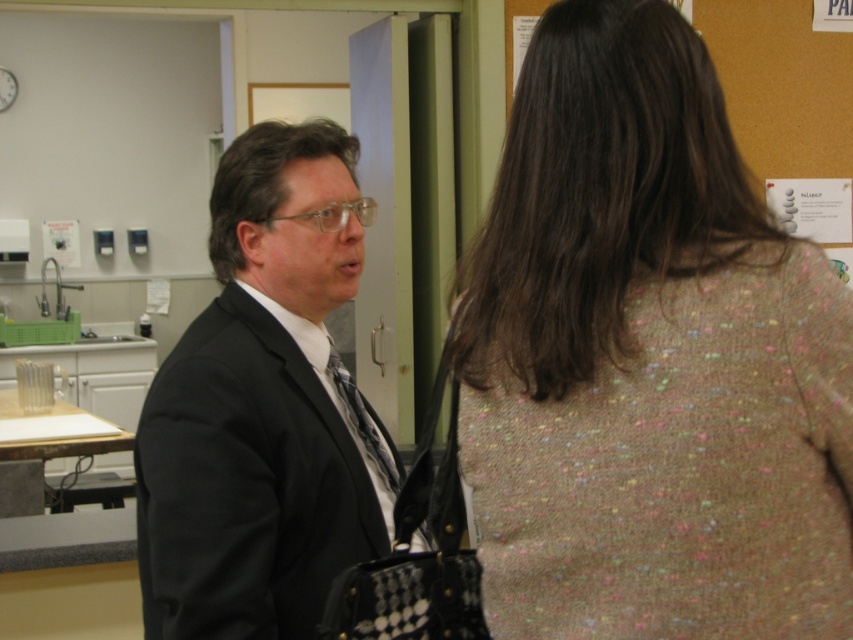
The width and height of the screenshot is (853, 640). What do you see at coordinates (648, 360) in the screenshot?
I see `speckled wool sweater at upper right` at bounding box center [648, 360].

Is point (534, 429) positioned behind point (389, 468)?

No, it is not.

Where is `speckled wool sweater at upper right`? speckled wool sweater at upper right is located at coordinates (648, 360).

Does black matte suit at center have a smaller size compared to patterned silk tie at center?

No.

Looking at this image, which is more to the left, black matte suit at center or patterned silk tie at center?

Positioned to the left is black matte suit at center.

Between point (293, 506) and point (334, 348), which one is positioned behind?

The point (334, 348) is behind.

Find the location of `black matte suit at center`. black matte suit at center is located at coordinates (263, 406).

Who is taller, speckled wool sweater at upper right or black matte suit at center?

black matte suit at center

Image resolution: width=853 pixels, height=640 pixels. What do you see at coordinates (648, 360) in the screenshot?
I see `speckled wool sweater at upper right` at bounding box center [648, 360].

You are a GUI agent. You are given a task and a screenshot of the screen. Output one action in this format:
    pyautogui.click(x=<x>, y=<y>)
    Task: Click on the speckled wool sweater at upper right
    
    Given the screenshot: What is the action you would take?
    pyautogui.click(x=648, y=360)

At what (x,y) coordinates should I click in order to perform the action: click on speckled wool sweater at upper right. Please return your answer as a coordinate pair (x, y). Looking at the image, I should click on (648, 360).